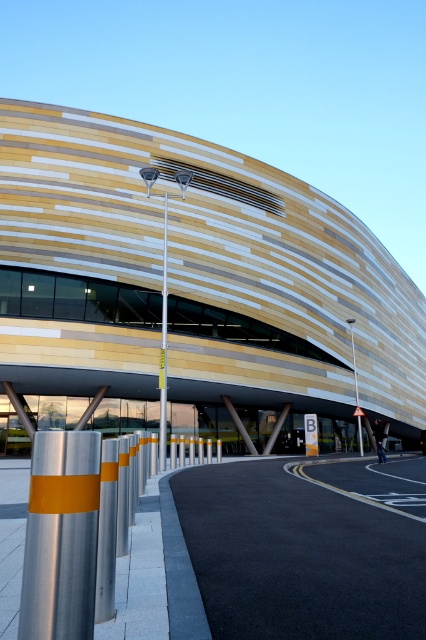
Between wooden paneling at center and silver metallic bollard at lower left, which one is positioned higher?

Positioned higher is wooden paneling at center.

Looking at this image, does wooden paneling at center appear over silver metallic bollard at lower left?

Yes.

At what (x,y) coordinates should I click in order to perform the action: click on wooden paneling at center. Please return your answer as a coordinate pair (x, y). Looking at the image, I should click on (x=192, y=285).

Can you confirm if metallic silver pole at center is taller than metallic pole at center?

Indeed, metallic silver pole at center has a greater height compared to metallic pole at center.

Who is more distant from viewer, (160, 378) or (351, 323)?

Point (351, 323)

Is point (164, 228) positioned after point (359, 433)?

No, it is not.

Where is `metallic silver pole at center`? metallic silver pole at center is located at coordinates (164, 348).

Which of these two, black asphalt road at lower center or metallic silver pole at center, stands taller?

metallic silver pole at center is taller.

Does point (181, 628) come farther from viewer compared to point (164, 385)?

No, it is not.

This screenshot has height=640, width=426. What are the coordinates of `black asphalt road at lower center` in the screenshot? It's located at (290, 557).